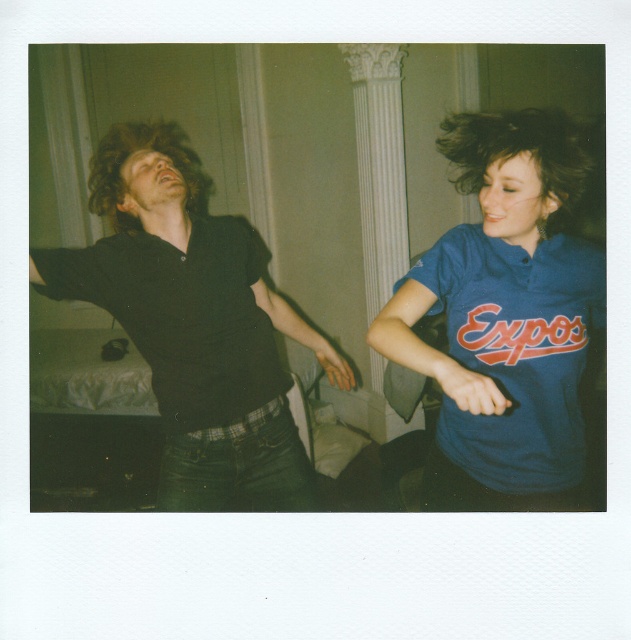
You are taking a photo of two people in an indoor space. You notice two points in the image at coordinates point (249, 269) and point (456, 129). If you want to focus on the point that is closer to you, which coordinate should you adjust your camera to focus on?

The point closer to the camera is point (249, 269), so you should adjust your camera to focus on point (249, 269).

Looking at this image, you are an artist trying to sketch the scene. You need to place the dark brown silky hair at upper right accurately. What are the coordinates for its position?

The coordinates for the dark brown silky hair at upper right are at point (534,161).